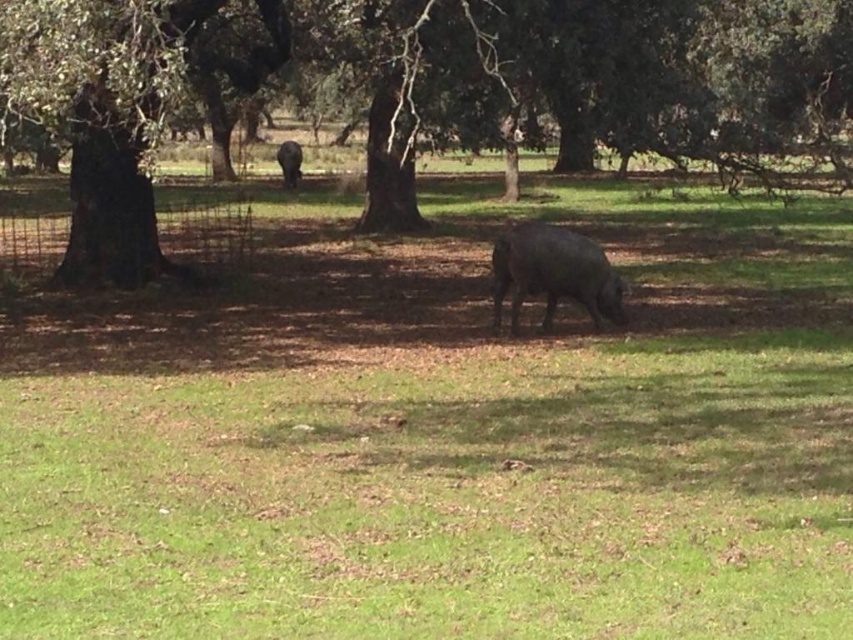
Question: Estimate the real-world distances between objects in this image. Which object is farther from the black matte pig at center?

Choices:
 (A) brown rough tree at left
 (B) dark brown bark at left

Answer: (A)

Question: Which point is closer to the camera?

Choices:
 (A) black matte pig at center
 (B) dark brown bark at left

Answer: (B)

Question: Is brown rough tree at left further to camera compared to dark gray matte pig at center?

Choices:
 (A) no
 (B) yes

Answer: (A)

Question: Among these points, which one is nearest to the camera?

Choices:
 (A) (171, 72)
 (B) (277, 157)
 (C) (611, 316)
 (D) (173, 28)

Answer: (A)

Question: Is brown rough tree at left thinner than dark brown bark at left?

Choices:
 (A) yes
 (B) no

Answer: (B)

Question: Does dark brown bark at left have a smaller size compared to dark gray matte pig at center?

Choices:
 (A) yes
 (B) no

Answer: (A)